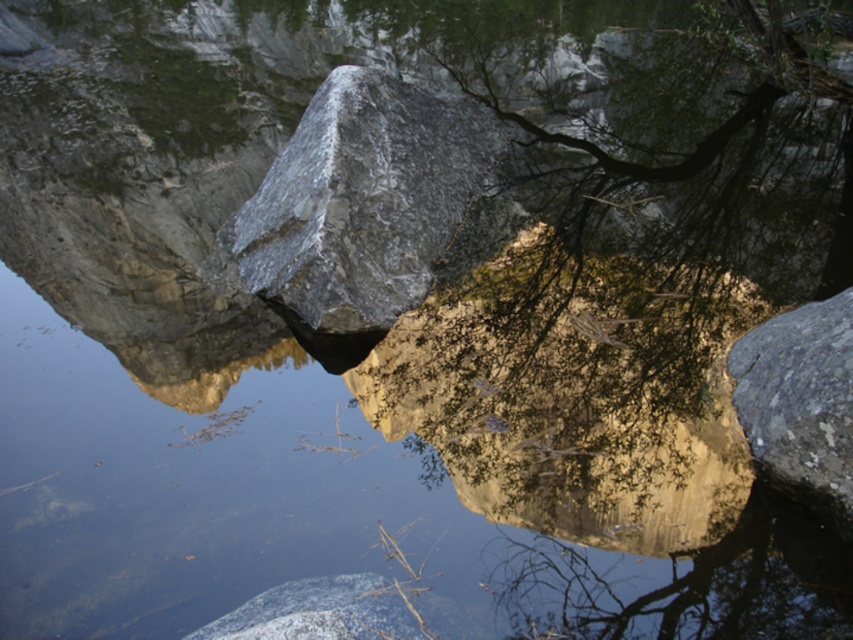
Question: Can you confirm if green leafy tree at center is smaller than gray/granite rock at center?

Choices:
 (A) no
 (B) yes

Answer: (A)

Question: Does clear water at center have a smaller size compared to green leafy tree at center?

Choices:
 (A) no
 (B) yes

Answer: (B)

Question: Which object is farther from the camera taking this photo?

Choices:
 (A) gray/granite rock at center
 (B) green leafy tree at center
 (C) gray/rough rock at lower center

Answer: (A)

Question: Can you confirm if green leafy tree at center is positioned to the right of gray/rough rock at lower center?

Choices:
 (A) yes
 (B) no

Answer: (A)

Question: Which point is closer to the camera?

Choices:
 (A) (384, 605)
 (B) (596, 461)

Answer: (A)

Question: Which object appears farthest from the camera in this image?

Choices:
 (A) gray/rough rock at lower center
 (B) clear water at center
 (C) green leafy tree at center

Answer: (C)